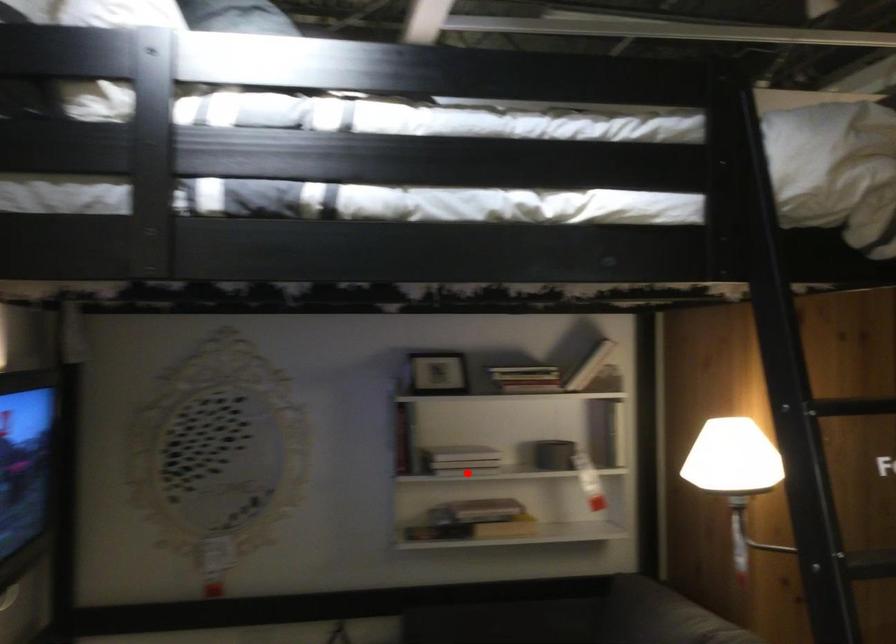
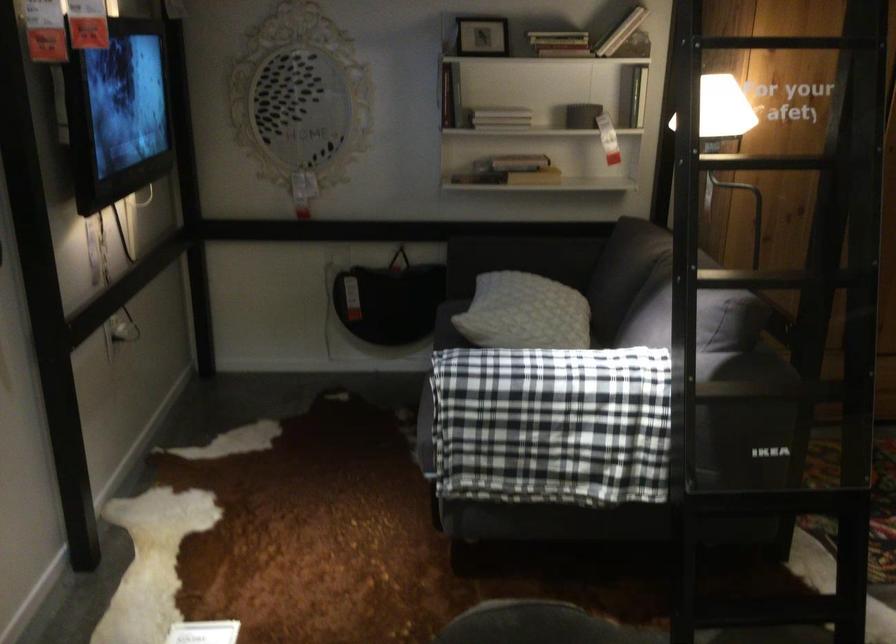
Question: I am providing you with two images of the same scene from different viewpoints. Given a red point in image1, look at the same physical point in image2. Is it:

Choices:
 (A) Closer to the viewpoint
 (B) Farther from the viewpoint

Answer: (B)